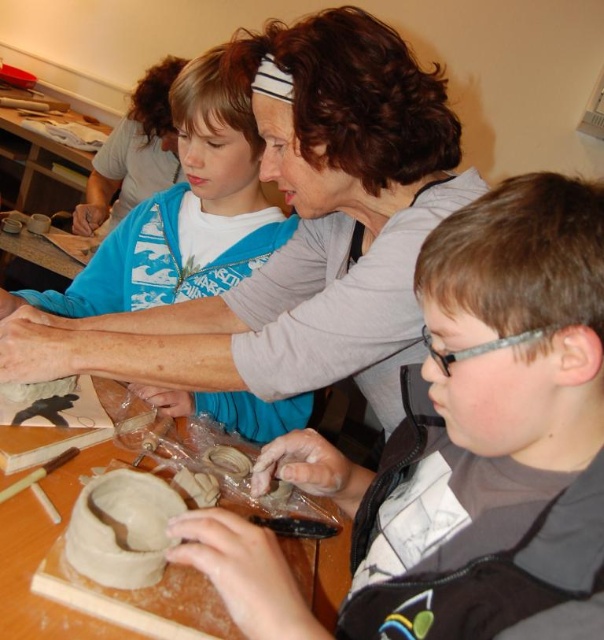
Question: Is matte gray clay at center positioned before blue fabric shirt at upper center?

Choices:
 (A) no
 (B) yes

Answer: (B)

Question: Among these points, which one is nearest to the camera?

Choices:
 (A) (248, 243)
 (B) (576, 339)

Answer: (B)

Question: Which of the following is the closest to the observer?

Choices:
 (A) (460, 545)
 (B) (135, 273)

Answer: (A)

Question: Is matte gray clay at center to the left of blue fabric shirt at upper center from the viewer's perspective?

Choices:
 (A) yes
 (B) no

Answer: (B)

Question: Observing the image, what is the correct spatial positioning of matte gray clay at center in reference to blue fabric shirt at upper center?

Choices:
 (A) right
 (B) left

Answer: (A)